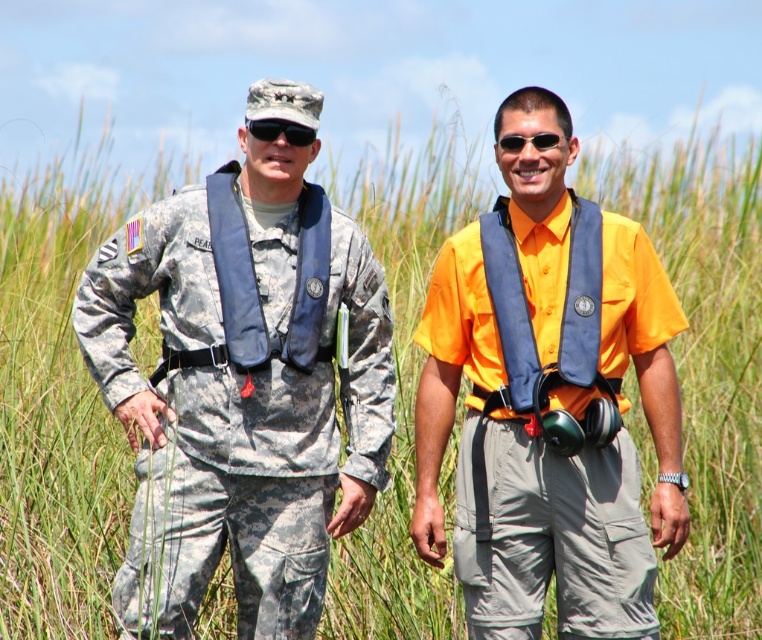
The height and width of the screenshot is (640, 762). What are the coordinates of `camouflage fabric uniform at left` in the screenshot? It's located at (242, 390).

Who is more distant from viewer, (312, 371) or (503, 148)?

The point (312, 371) is more distant.

Identify the location of camouflage fabric uniform at left. (242, 390).

This screenshot has height=640, width=762. I want to click on camouflage fabric uniform at left, so click(x=242, y=390).

Does yellow matte shirt at center have a greater width compared to blue fabric life vest at left?

Indeed, yellow matte shirt at center has a greater width compared to blue fabric life vest at left.

Which is above, yellow matte shirt at center or blue fabric life vest at left?

Positioned higher is blue fabric life vest at left.

What do you see at coordinates (548, 401) in the screenshot? I see `yellow matte shirt at center` at bounding box center [548, 401].

In order to click on yellow matte shirt at center in this screenshot , I will do `click(548, 401)`.

Identify the location of camouflage fabric uniform at left. Image resolution: width=762 pixels, height=640 pixels. (242, 390).

Between point (359, 413) and point (239, 220), which one is positioned in front?

Point (239, 220)

Locate an element on the screen. The image size is (762, 640). camouflage fabric uniform at left is located at coordinates (242, 390).